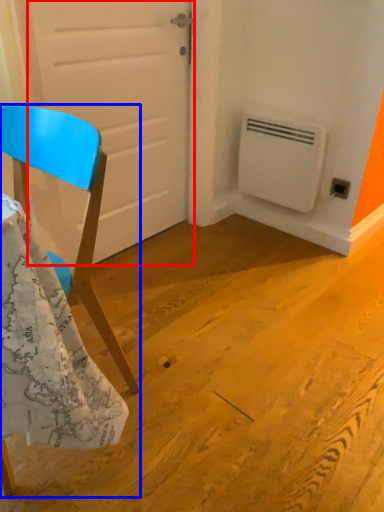
Question: Which point is closer to the camera, door (highlighted by a red box) or chair (highlighted by a blue box)?

Choices:
 (A) door
 (B) chair

Answer: (B)